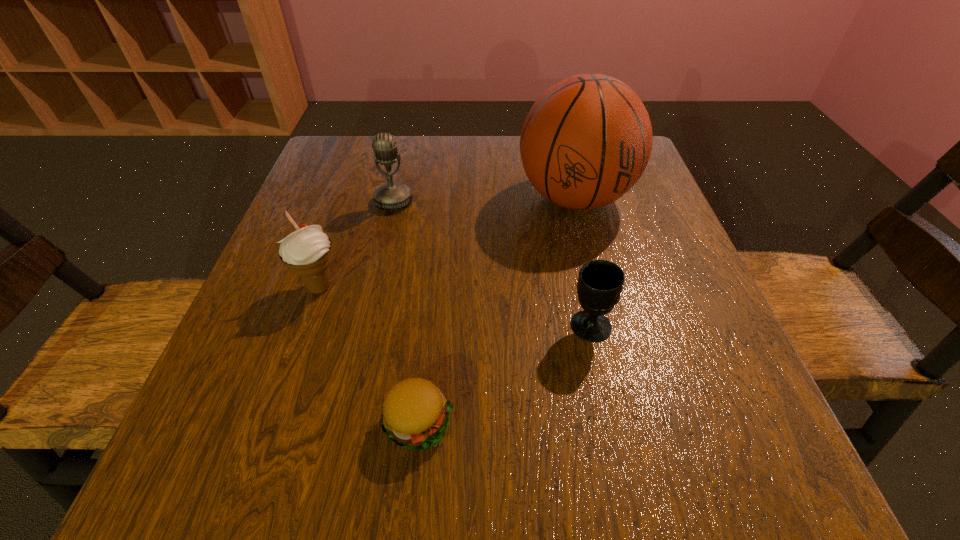
The width and height of the screenshot is (960, 540). I want to click on object present at the far right corner, so click(x=586, y=141).

Image resolution: width=960 pixels, height=540 pixels. I want to click on vacant region at the far edge of the desktop, so click(x=443, y=170).

The width and height of the screenshot is (960, 540). In the image, there is a desktop. Identify the location of vacant space at the near edge. (329, 433).

In the image, there is a desktop. Identify the location of free space at the left edge. The width and height of the screenshot is (960, 540). (343, 240).

Locate an element on the screen. The height and width of the screenshot is (540, 960). vacant space at the right edge of the desktop is located at coordinates (623, 209).

At what (x,y) coordinates should I click in order to perform the action: click on free location at the far left corner. Please return your answer as a coordinate pair (x, y). This screenshot has height=540, width=960. Looking at the image, I should click on (376, 188).

At what (x,y) coordinates should I click in order to perform the action: click on vacant area that lies between the shortest object and the second nearest object. Please return your answer as a coordinate pair (x, y). Image resolution: width=960 pixels, height=540 pixels. Looking at the image, I should click on (504, 374).

What are the coordinates of `blank region between the third farthest object and the nearest object` in the screenshot? It's located at (369, 355).

Identify the location of free space between the second nearest object and the leftmost object. (455, 306).

This screenshot has height=540, width=960. Find the location of `vacant point located between the second object from left to right and the chalice`. vacant point located between the second object from left to right and the chalice is located at coordinates (492, 264).